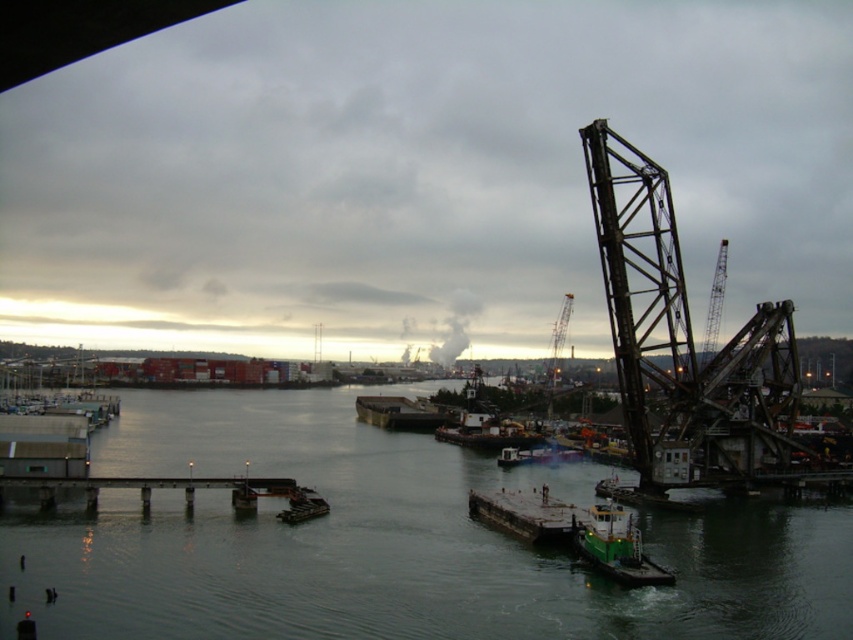
Question: Does green matte tugboat at lower right appear on the left side of dark gray metal barge at center?

Choices:
 (A) yes
 (B) no

Answer: (B)

Question: Based on their relative distances, which object is nearer to the greenish water at center?

Choices:
 (A) concrete pier at lower center
 (B) dark gray concrete dock at center
 (C) dark gray metal barge at center

Answer: (B)

Question: Is concrete pier at lower center wider than metallic gray crane at center?

Choices:
 (A) yes
 (B) no

Answer: (A)

Question: Estimate the real-world distances between objects in this image. Which object is closer to the dark gray concrete dock at center?

Choices:
 (A) green matte tugboat at center
 (B) greenish water at center

Answer: (B)

Question: Which of the following is the farthest from the observer?

Choices:
 (A) concrete pier at lower center
 (B) green matte tugboat at center
 (C) green matte boat at center
 (D) dark gray metal barge at center

Answer: (D)

Question: Does green matte tugboat at center appear under metallic gray crane at center?

Choices:
 (A) no
 (B) yes

Answer: (B)